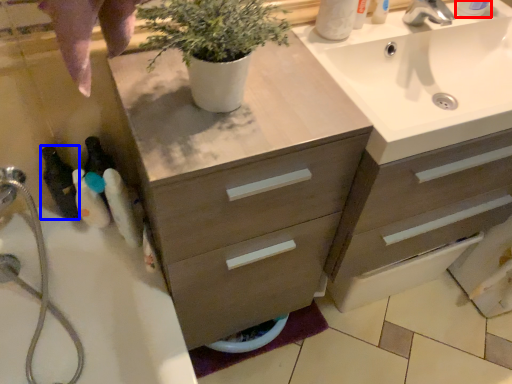
Question: Which of the following is the closest to the observer, toiletry (highlighted by a red box) or toiletry (highlighted by a blue box)?

Choices:
 (A) toiletry
 (B) toiletry

Answer: (A)